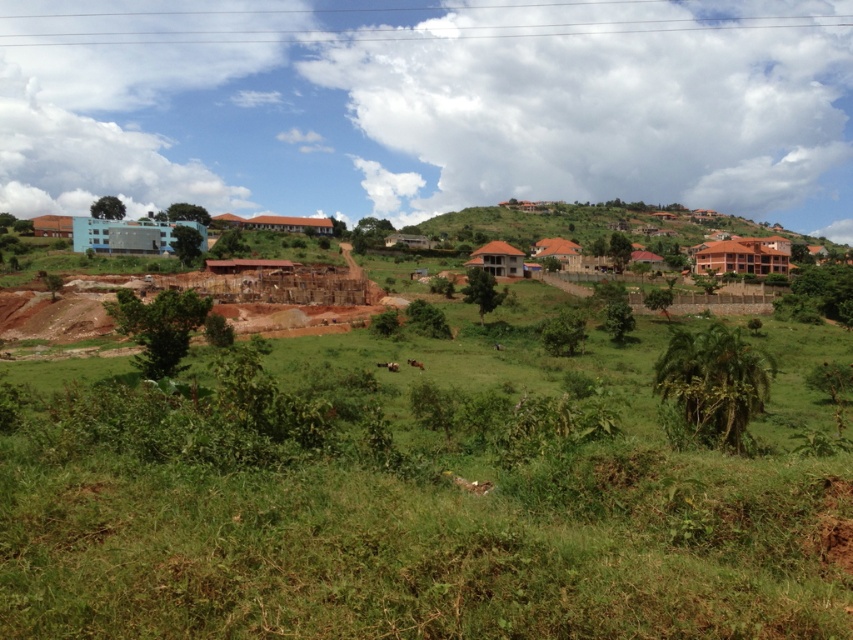
Locate an element on the screen. The height and width of the screenshot is (640, 853). brown wooden house at center is located at coordinates (497, 259).

This screenshot has height=640, width=853. What do you see at coordinates (497, 259) in the screenshot?
I see `brown wooden house at center` at bounding box center [497, 259].

Locate an element on the screen. brown wooden house at center is located at coordinates (497, 259).

This screenshot has width=853, height=640. Describe the element at coordinates (129, 236) in the screenshot. I see `blue glass building at upper left` at that location.

Is blue glass building at upper left smaller than matte brick hut at left?

Actually, blue glass building at upper left might be larger than matte brick hut at left.

Image resolution: width=853 pixels, height=640 pixels. I want to click on blue glass building at upper left, so click(129, 236).

The width and height of the screenshot is (853, 640). What are the coordinates of `blue glass building at upper left` in the screenshot? It's located at (129, 236).

Does brown matte building at right have a greater width compared to brown wooden house at center?

Yes.

Which is below, brown matte building at right or brown wooden house at center?

Positioned lower is brown wooden house at center.

Which is behind, point (699, 250) or point (498, 243)?

Positioned behind is point (699, 250).

Image resolution: width=853 pixels, height=640 pixels. Identify the location of brown matte building at right. (741, 257).